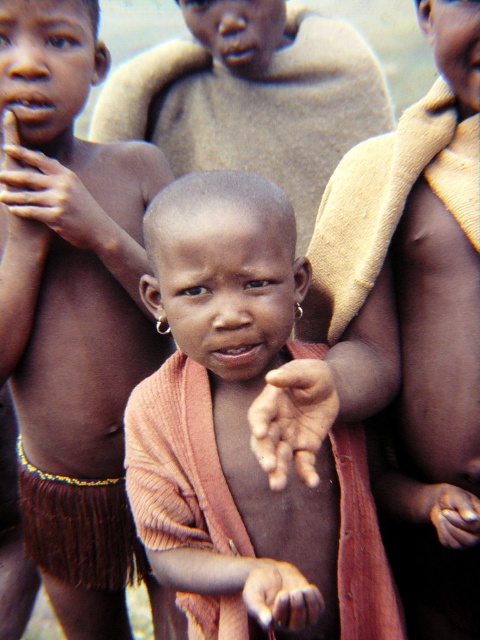
Which is more to the right, matte orange sweater at center or smooth skin child at center?

Positioned to the right is smooth skin child at center.

Between matte orange sweater at center and smooth skin child at center, which one has more height?

matte orange sweater at center is taller.

Locate an element on the screen. matte orange sweater at center is located at coordinates (72, 301).

What do you see at coordinates (240, 422) in the screenshot?
I see `matte orange cloth at center` at bounding box center [240, 422].

Between matte orange cloth at center and brown skin hand at left, which one has less height?

With less height is brown skin hand at left.

Describe the element at coordinates (240, 422) in the screenshot. I see `matte orange cloth at center` at that location.

This screenshot has height=640, width=480. What are the coordinates of `matte orange cloth at center` in the screenshot? It's located at (240, 422).

Does smooth skin hand at center have a greater width compared to smooth brown hand at center?

Yes.

Is point (249, 563) closer to viewer compared to point (460, 541)?

No.

Identify the location of smooth skin hand at center. (277, 595).